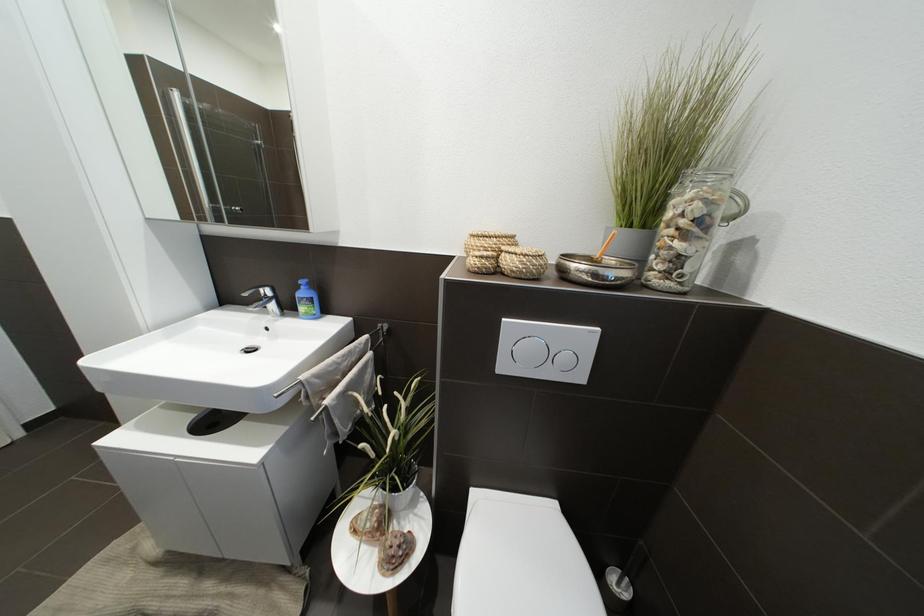
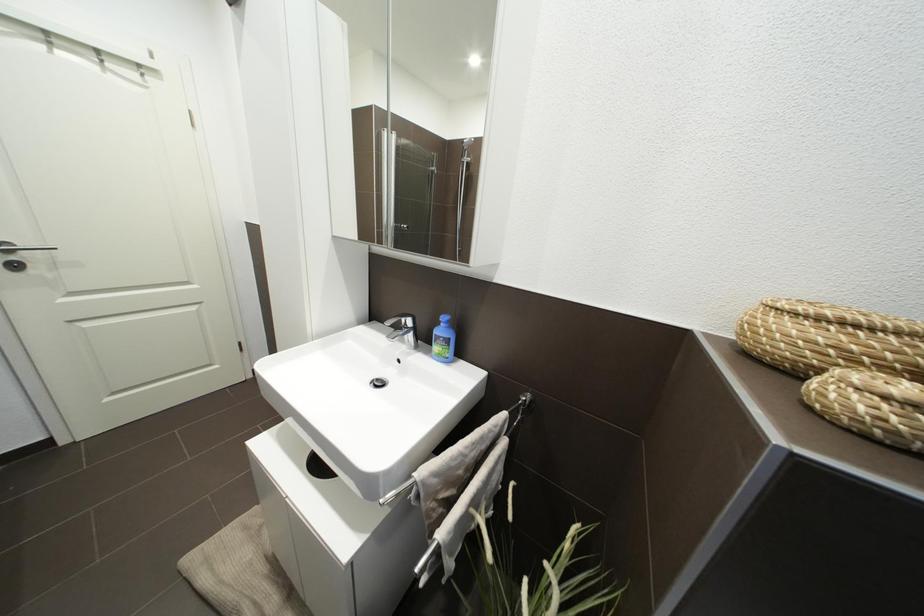
Which direction would the cameraman need to move to produce the second image?

The cameraman moved toward left, forward.